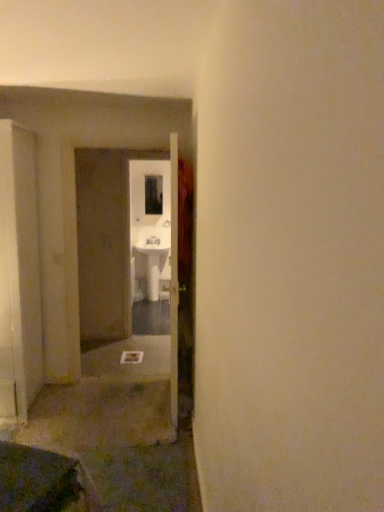
What do you see at coordinates (155, 257) in the screenshot? This screenshot has width=384, height=512. I see `white glossy sink at center` at bounding box center [155, 257].

The image size is (384, 512). In order to click on white glossy sink at center in this screenshot , I will do `click(155, 257)`.

What do you see at coordinates (153, 194) in the screenshot? Image resolution: width=384 pixels, height=512 pixels. I see `transparent glass window at center` at bounding box center [153, 194].

Identify the location of transparent glass window at center. The image size is (384, 512). (153, 194).

This screenshot has height=512, width=384. I want to click on white glossy sink at center, so click(x=155, y=257).

Does white glossy sink at center appear on the right side of transparent glass window at center?

Indeed, white glossy sink at center is positioned on the right side of transparent glass window at center.

Considering their positions, is white glossy sink at center located in front of or behind transparent glass window at center?

Visually, white glossy sink at center is located in front of transparent glass window at center.

Does point (165, 257) come behind point (149, 212)?

No, it is in front of (149, 212).

From the image's perspective, is white glossy sink at center over transparent glass window at center?

No, from the image's perspective, white glossy sink at center is not over transparent glass window at center.

From a real-world perspective, is white glossy sink at center above or below transparent glass window at center?

white glossy sink at center is situated lower than transparent glass window at center in the real world.

Is white glossy sink at center wider than transparent glass window at center?

Indeed, white glossy sink at center has a greater width compared to transparent glass window at center.

Considering the relative sizes of white glossy sink at center and transparent glass window at center in the image provided, is white glossy sink at center taller than transparent glass window at center?

Correct, white glossy sink at center is much taller as transparent glass window at center.

Does white glossy sink at center have a larger size compared to transparent glass window at center?

Indeed, white glossy sink at center has a larger size compared to transparent glass window at center.

Would you say white glossy sink at center contains transparent glass window at center?

No.

Would you consider white glossy sink at center to be distant from transparent glass window at center?

No, white glossy sink at center is in close proximity to transparent glass window at center.

Is white glossy sink at center facing away from transparent glass window at center?

white glossy sink at center does not have its back to transparent glass window at center.

Looking at this image, what's the angular difference between white glossy sink at center and transparent glass window at center's facing directions?

The angle between the facing direction of white glossy sink at center and the facing direction of transparent glass window at center is 1.34 degrees.

Locate an element on the screen. window above the white glossy sink at center (from a real-world perspective) is located at coordinates (153, 194).

Which is more to the left, transparent glass window at center or white glossy sink at center?

Positioned to the left is transparent glass window at center.

Is transparent glass window at center closer to camera compared to white glossy sink at center?

No.

Which is farther, (159, 198) or (165, 239)?

Positioned behind is point (159, 198).

From the image's perspective, is transparent glass window at center on top of white glossy sink at center?

Yes, from the image's perspective, transparent glass window at center is over white glossy sink at center.

From a real-world perspective, is transparent glass window at center physically located above or below white glossy sink at center?

transparent glass window at center is situated higher than white glossy sink at center in the real world.

Does transparent glass window at center have a lesser width compared to white glossy sink at center?

Yes, transparent glass window at center is thinner than white glossy sink at center.

In terms of height, does transparent glass window at center look taller or shorter compared to white glossy sink at center?

In the image, transparent glass window at center appears to be shorter than white glossy sink at center.

Considering the relative sizes of transparent glass window at center and white glossy sink at center in the image provided, is transparent glass window at center smaller than white glossy sink at center?

Yes.

Would you say transparent glass window at center contains white glossy sink at center?

Actually, white glossy sink at center is outside transparent glass window at center.

Are transparent glass window at center and white glossy sink at center located far from each other?

No, transparent glass window at center is not far away from white glossy sink at center.

Is transparent glass window at center positioned with its back to white glossy sink at center?

That's not correct — transparent glass window at center is not looking away from white glossy sink at center.

Based on the photo, how distant is transparent glass window at center from white glossy sink at center?

transparent glass window at center is 57.06 centimeters from white glossy sink at center.

I want to click on sink in front of the transparent glass window at center, so click(155, 257).

Where is `window located behind the white glossy sink at center`? Image resolution: width=384 pixels, height=512 pixels. window located behind the white glossy sink at center is located at coordinates point(153,194).

This screenshot has height=512, width=384. Identify the location of sink in front of the transparent glass window at center. (155, 257).